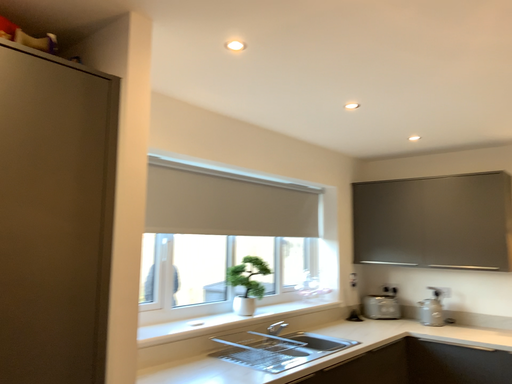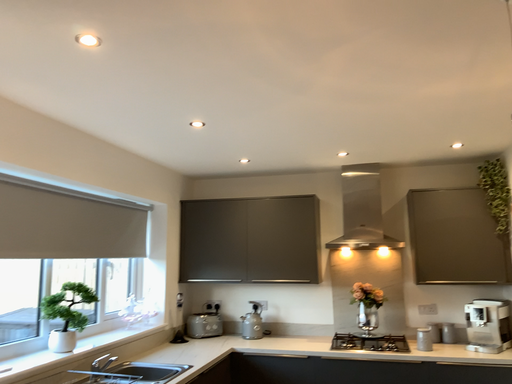
Question: How did the camera likely rotate when shooting the video?

Choices:
 (A) rotated right
 (B) rotated left

Answer: (A)